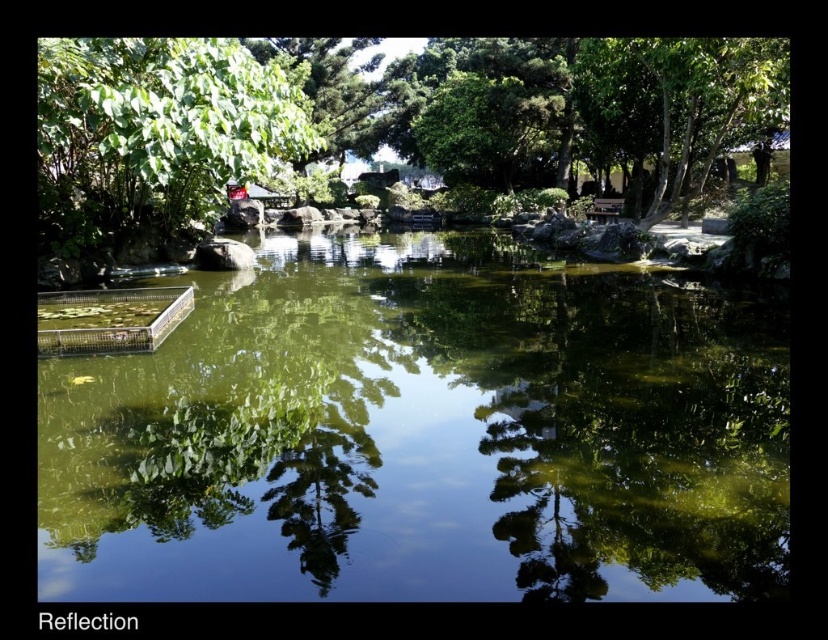
Question: Can you confirm if green leafy tree at upper left is positioned to the left of green leafy tree at upper right?

Choices:
 (A) yes
 (B) no

Answer: (A)

Question: Which point is closer to the camera taking this photo?

Choices:
 (A) (668, 48)
 (B) (467, 422)

Answer: (B)

Question: Among these points, which one is nearest to the camera?

Choices:
 (A) (762, 108)
 (B) (542, 515)

Answer: (B)

Question: Is green translucent water at center positioned before green leafy tree at upper left?

Choices:
 (A) no
 (B) yes

Answer: (B)

Question: Is green translucent water at center to the left of green leafy tree at upper right from the viewer's perspective?

Choices:
 (A) no
 (B) yes

Answer: (B)

Question: Which point is farther to the camera?

Choices:
 (A) green translucent water at center
 (B) green leafy tree at upper right

Answer: (B)